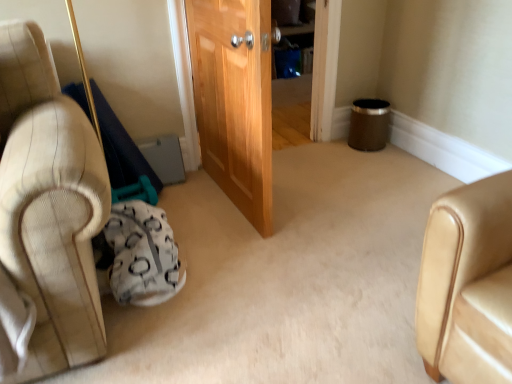
Where is `white textured bean bag at lower left`? This screenshot has width=512, height=384. white textured bean bag at lower left is located at coordinates (143, 255).

What is the approximate height of white textured bean bag at lower left?

The height of white textured bean bag at lower left is 10.89 inches.

What do you see at coordinates (143, 255) in the screenshot? This screenshot has width=512, height=384. I see `white textured bean bag at lower left` at bounding box center [143, 255].

This screenshot has height=384, width=512. Find the location of `wooden door at center`. wooden door at center is located at coordinates (234, 100).

This screenshot has width=512, height=384. Describe the element at coordinates (234, 100) in the screenshot. I see `wooden door at center` at that location.

What are the coordinates of `white textured bean bag at lower left` in the screenshot? It's located at pos(143,255).

Between white textured bean bag at lower left and wooden door at center, which one appears on the left side from the viewer's perspective?

white textured bean bag at lower left is more to the left.

Which is in front, white textured bean bag at lower left or wooden door at center?

white textured bean bag at lower left is in front.

Which point is more distant from viewer, (169, 296) or (255, 160)?

The point (255, 160) is farther from the camera.

From the image's perspective, would you say white textured bean bag at lower left is positioned over wooden door at center?

Incorrect, from the image's perspective, white textured bean bag at lower left is lower than wooden door at center.

From a real-world perspective, is white textured bean bag at lower left on top of wooden door at center?

No.

Is white textured bean bag at lower left wider than wooden door at center?

Indeed, white textured bean bag at lower left has a greater width compared to wooden door at center.

Considering the relative sizes of white textured bean bag at lower left and wooden door at center in the image provided, is white textured bean bag at lower left shorter than wooden door at center?

Correct, white textured bean bag at lower left is not as tall as wooden door at center.

Looking at the image, does white textured bean bag at lower left seem bigger or smaller compared to wooden door at center?

white textured bean bag at lower left is smaller than wooden door at center.

Is white textured bean bag at lower left not inside wooden door at center?

white textured bean bag at lower left lies outside wooden door at center's area.

Is white textured bean bag at lower left not near wooden door at center?

No, there isn't a large distance between white textured bean bag at lower left and wooden door at center.

Does white textured bean bag at lower left turn towards wooden door at center?

No, white textured bean bag at lower left is not facing towards wooden door at center.

How different are the orientations of white textured bean bag at lower left and wooden door at center in degrees?

The angle between the facing direction of white textured bean bag at lower left and the facing direction of wooden door at center is 1.56 degrees.

How far apart are white textured bean bag at lower left and wooden door at center?

white textured bean bag at lower left is 22.92 inches away from wooden door at center.

Find the location of a particular element. door on the right of white textured bean bag at lower left is located at coordinates (234, 100).

Visually, is wooden door at center positioned to the left or to the right of white textured bean bag at lower left?

wooden door at center is positioned on white textured bean bag at lower left's right side.

Which object is further away from the camera taking this photo, wooden door at center or white textured bean bag at lower left?

Positioned behind is wooden door at center.

Considering the points (264, 226) and (117, 258), which point is behind, point (264, 226) or point (117, 258)?

Positioned behind is point (264, 226).

From the image's perspective, which is below, wooden door at center or white textured bean bag at lower left?

From the image's view, white textured bean bag at lower left is below.

From a real-world perspective, is wooden door at center on top of white textured bean bag at lower left?

Indeed, from a real-world perspective, wooden door at center stands above white textured bean bag at lower left.

Considering the relative sizes of wooden door at center and white textured bean bag at lower left in the image provided, is wooden door at center wider than white textured bean bag at lower left?

No.

Can you confirm if wooden door at center is taller than white textured bean bag at lower left?

Indeed, wooden door at center has a greater height compared to white textured bean bag at lower left.

Does wooden door at center have a larger size compared to white textured bean bag at lower left?

Yes.

Is wooden door at center inside or outside of white textured bean bag at lower left?

wooden door at center is outside white textured bean bag at lower left.

Are wooden door at center and white textured bean bag at lower left far apart?

Actually, wooden door at center and white textured bean bag at lower left are a little close together.

Is wooden door at center positioned with its back to white textured bean bag at lower left?

No, wooden door at center is not facing away from white textured bean bag at lower left.

Locate an element on the screen. This screenshot has height=384, width=512. bean bag chair in front of the wooden door at center is located at coordinates (143, 255).

Where is `door above the white textured bean bag at lower left (from the image's perspective)`? The image size is (512, 384). door above the white textured bean bag at lower left (from the image's perspective) is located at coordinates (234, 100).

Locate an element on the screen. bean bag chair below the wooden door at center (from the image's perspective) is located at coordinates (143, 255).